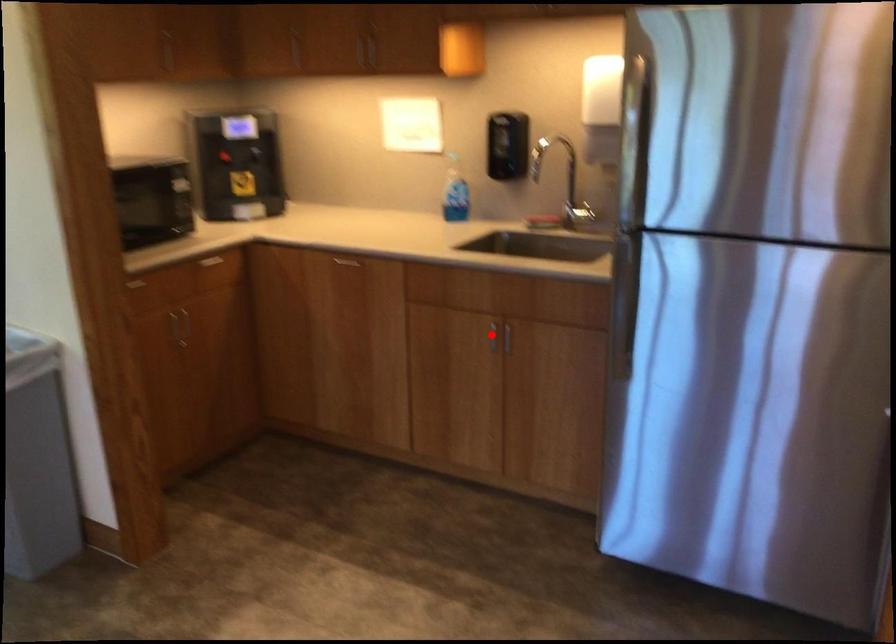
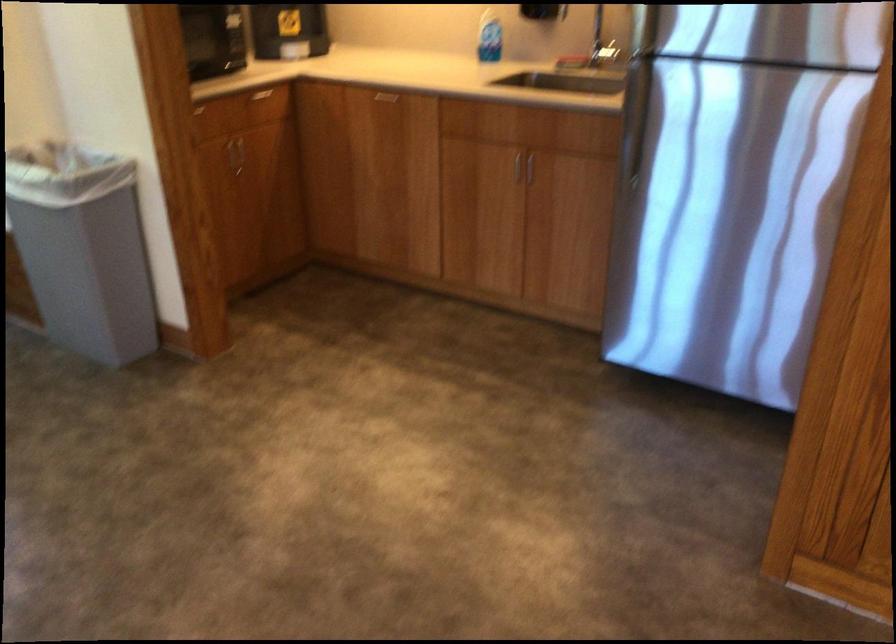
Where in the second image is the point corresponding to the highlighted location from the first image?

(515, 165)